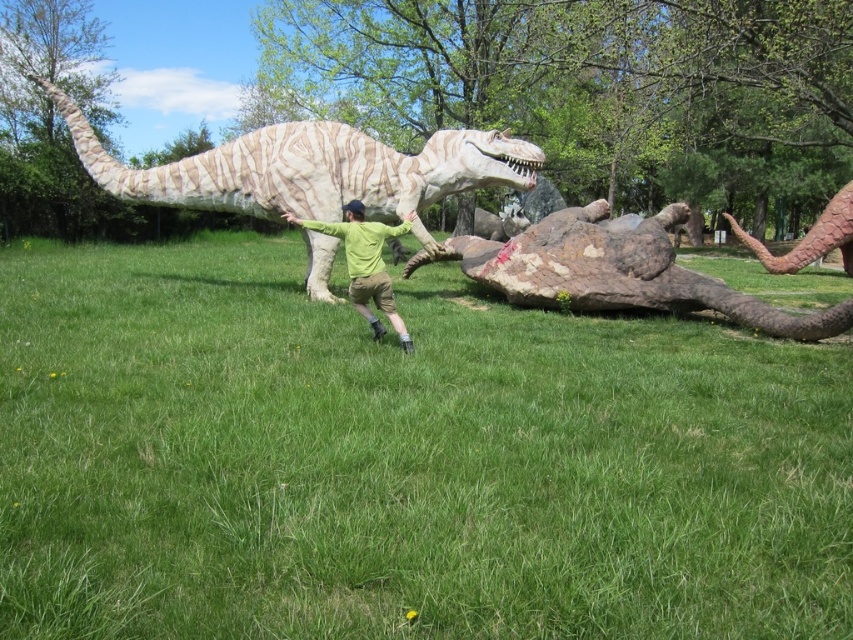
Question: Considering the real-world distances, which object is closest to the white textured dinosaur at center?

Choices:
 (A) green grass at center
 (B) brown textured tail at right

Answer: (A)

Question: Estimate the real-world distances between objects in this image. Which object is closer to the brown textured tail at right?

Choices:
 (A) green matte shirt at center
 (B) white textured dinosaur at center
 (C) green grass at center

Answer: (B)

Question: Is green grass at center below brown textured tail at right?

Choices:
 (A) no
 (B) yes

Answer: (B)

Question: Which object appears closest to the camera in this image?

Choices:
 (A) green matte shirt at center
 (B) brown textured tail at right

Answer: (A)

Question: Can you confirm if green grass at center is smaller than green matte shirt at center?

Choices:
 (A) no
 (B) yes

Answer: (A)

Question: Does white textured dinosaur at center come behind green matte shirt at center?

Choices:
 (A) yes
 (B) no

Answer: (A)